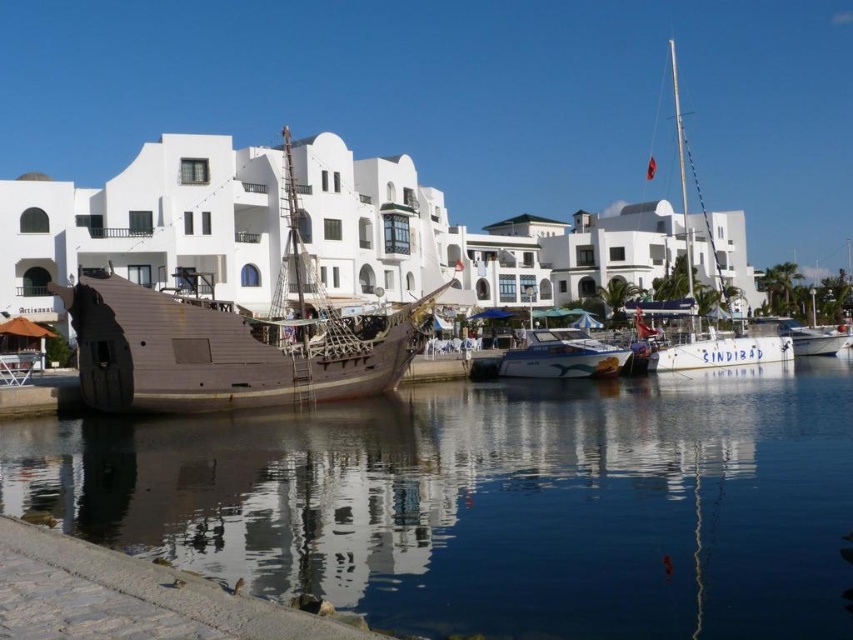
Who is lower down, white glossy sailboat at center or white glossy boat at center?

Positioned lower is white glossy boat at center.

Who is more forward, (664, 355) or (573, 368)?

Positioned in front is point (573, 368).

Who is more forward, (775, 355) or (590, 340)?

Point (590, 340) is in front.

The image size is (853, 640). In order to click on white glossy sailboat at center in this screenshot , I will do `click(718, 352)`.

Which is in front, point (117, 291) or point (779, 358)?

Point (117, 291) is in front.

Does wooden pirate ship at center have a larger size compared to white glossy sailboat at center?

Incorrect, wooden pirate ship at center is not larger than white glossy sailboat at center.

This screenshot has height=640, width=853. What do you see at coordinates (236, 333) in the screenshot?
I see `wooden pirate ship at center` at bounding box center [236, 333].

You are a GUI agent. You are given a task and a screenshot of the screen. Output one action in this format:
    pyautogui.click(x=<x>, y=<y>)
    Task: Click on the wooden pirate ship at center
    
    Given the screenshot: What is the action you would take?
    pyautogui.click(x=236, y=333)

Who is positioned more to the left, transparent water at lower center or white glossy sailboat at center?

Positioned to the left is transparent water at lower center.

In the scene shown: Does transparent water at lower center have a smaller size compared to white glossy sailboat at center?

Yes.

Which is behind, point (373, 428) or point (752, 348)?

Positioned behind is point (752, 348).

At what (x,y) coordinates should I click in order to perform the action: click on transparent water at lower center. Please return your answer as a coordinate pair (x, y). Looking at the image, I should click on (491, 502).